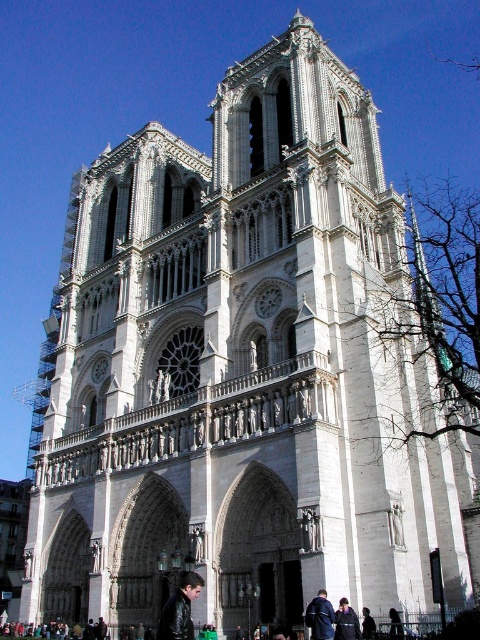
Looking at this image, is leather jacket at lower center above dark blue leather jacket at lower right?

Incorrect, leather jacket at lower center is not positioned above dark blue leather jacket at lower right.

Who is more forward, [193,589] or [347,609]?

Point [193,589] is more forward.

Find the location of a particular element. leather jacket at lower center is located at coordinates (180, 609).

In the scene shown: Between leather jacket at lower center and dark brown leather jacket at lower right, which one is positioned higher?

dark brown leather jacket at lower right is above.

From the picture: Is leather jacket at lower center below dark brown leather jacket at lower right?

Yes, leather jacket at lower center is below dark brown leather jacket at lower right.

Is point (171, 614) positioned before point (369, 612)?

Yes, it is.

I want to click on leather jacket at lower center, so click(x=180, y=609).

Is point (334, 616) positioned after point (359, 624)?

No, it is in front of (359, 624).

From the picture: Can you confirm if dark blue leather jacket at lower center is positioned below dark blue leather jacket at lower right?

Incorrect, dark blue leather jacket at lower center is not positioned below dark blue leather jacket at lower right.

Does point (322, 602) lie behind point (340, 618)?

That is False.

Identify the location of dark blue leather jacket at lower center. (320, 616).